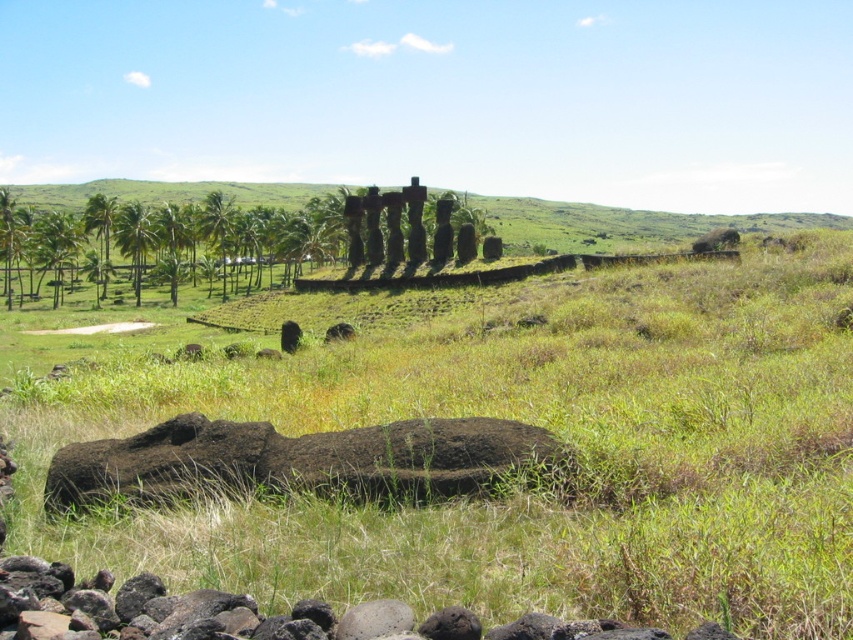
Question: Does black rough rock at lower center appear on the right side of green leafy palm tree at left?

Choices:
 (A) yes
 (B) no

Answer: (A)

Question: From the image, what is the correct spatial relationship of green grassy at center in relation to green leafy palm tree at left?

Choices:
 (A) above
 (B) below

Answer: (B)

Question: Is black rough rock at lower center closer to camera compared to green leafy palm tree at left?

Choices:
 (A) no
 (B) yes

Answer: (B)

Question: Which object is positioned farthest from the black rough rock at lower center?

Choices:
 (A) green grassy at center
 (B) green leafy palm tree at left

Answer: (B)

Question: Among these points, which one is farthest from the camera?

Choices:
 (A) (459, 413)
 (B) (238, 208)

Answer: (B)

Question: Among these objects, which one is nearest to the camera?

Choices:
 (A) green leafy palm tree at left
 (B) green grassy at center

Answer: (B)